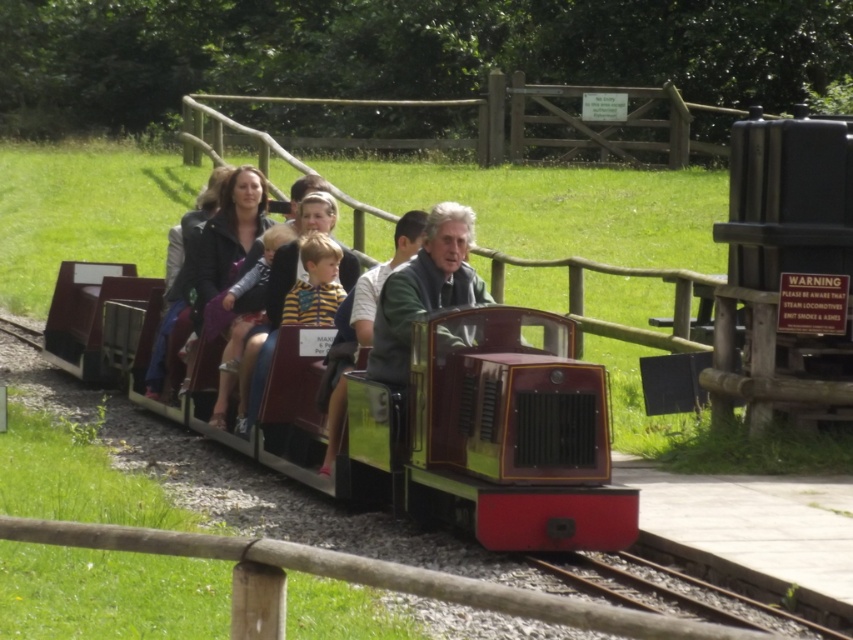
Looking at this image, you are a passenger on the train and want to take a photo of the yellow striped sweater at center through the window. Since the matte black train car at center is blocking your view, can you move to the left side of the train to get a clear shot?

The matte black train car at center is in front of the yellow striped sweater at center, so moving to the left side of the train might allow you to see around the matte black train car at center and capture the yellow striped sweater at center in your photo.